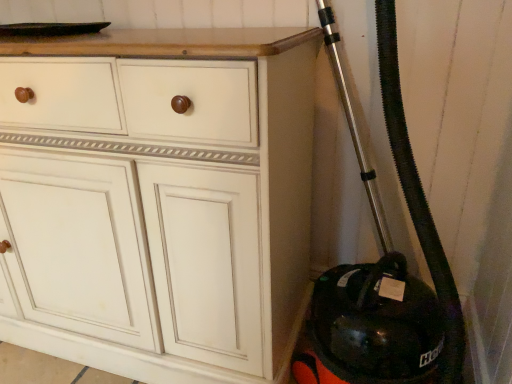
You are a GUI agent. You are given a task and a screenshot of the screen. Output one action in this format:
    pyautogui.click(x=<x>, y=<y>)
    Task: Click on the white painted wood cabinet at center
    This screenshot has height=384, width=512.
    Given the screenshot: What is the action you would take?
    pyautogui.click(x=158, y=200)

What do you see at coordinates (158, 200) in the screenshot? The height and width of the screenshot is (384, 512). I see `white painted wood cabinet at center` at bounding box center [158, 200].

Where is `white painted wood cabinet at center`? Image resolution: width=512 pixels, height=384 pixels. white painted wood cabinet at center is located at coordinates (158, 200).